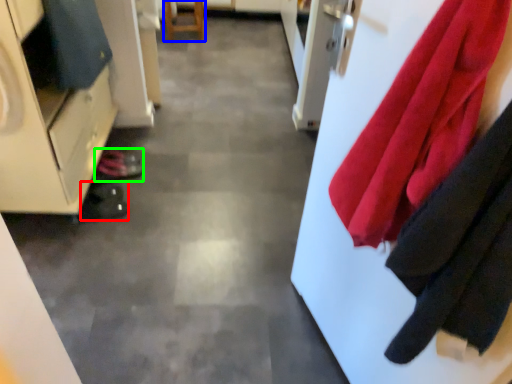
Question: Considering the real-world distances, which object is closest to shoe (highlighted by a red box)? furniture (highlighted by a blue box) or shoe (highlighted by a green box).

Choices:
 (A) furniture
 (B) shoe

Answer: (B)